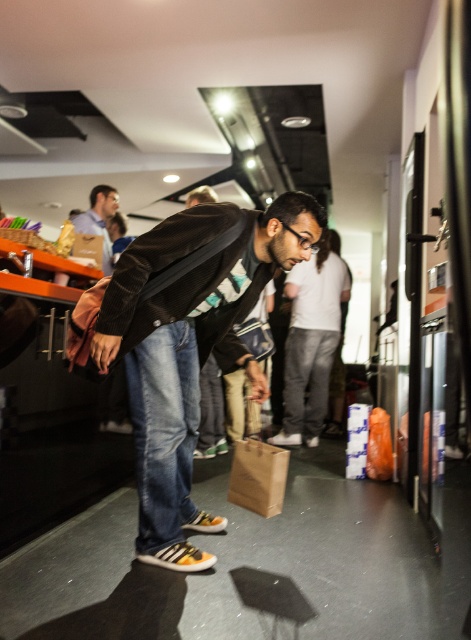
Question: Can you confirm if dark brown leather jacket at center is thinner than matte blue shirt at upper left?

Choices:
 (A) no
 (B) yes

Answer: (A)

Question: Which point is farther to the camera?

Choices:
 (A) (99, 340)
 (B) (97, 230)

Answer: (B)

Question: Observing the image, what is the correct spatial positioning of dark brown leather jacket at center in reference to matte blue shirt at upper left?

Choices:
 (A) left
 (B) right

Answer: (B)

Question: Does dark brown leather jacket at center appear under matte blue shirt at upper left?

Choices:
 (A) no
 (B) yes

Answer: (B)